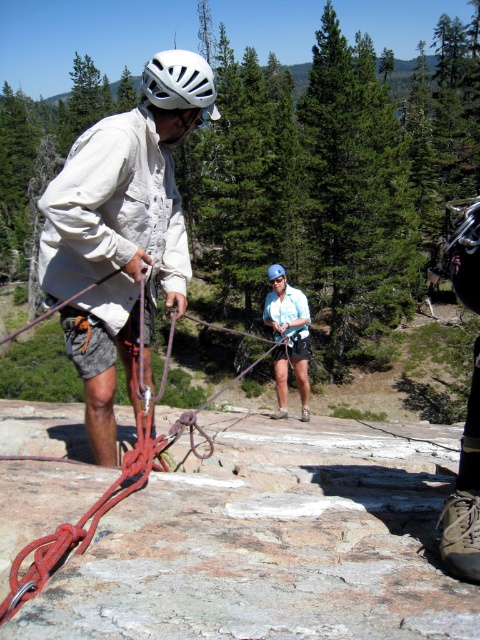
Is blue fabric shirt at center below white matte helmet at upper center?

Yes.

Is blue fabric shirt at center taller than white matte helmet at upper center?

In fact, blue fabric shirt at center may be shorter than white matte helmet at upper center.

Find the location of a particular element. This screenshot has width=480, height=640. blue fabric shirt at center is located at coordinates (288, 337).

Locate an element on the screen. The height and width of the screenshot is (640, 480). blue fabric shirt at center is located at coordinates (288, 337).

Who is higher up, red synthetic rope at center or white matte helmet at upper center?

white matte helmet at upper center is above.

Which is more to the right, red synthetic rope at center or white matte helmet at upper center?

Positioned to the right is red synthetic rope at center.

In the scene shown: Measure the distance between red synthetic rope at center and camera.

red synthetic rope at center and camera are 6.14 feet apart.

Find the location of a particular element. This screenshot has width=480, height=640. red synthetic rope at center is located at coordinates (111, 483).

Based on the photo, who is higher up, white matte helmet at center or white matte helmet at upper center?

white matte helmet at upper center is higher up.

This screenshot has height=640, width=480. What do you see at coordinates (121, 230) in the screenshot?
I see `white matte helmet at center` at bounding box center [121, 230].

Who is more forward, (60, 284) or (168, 70)?

Point (168, 70) is more forward.

Locate an element on the screen. This screenshot has width=480, height=640. white matte helmet at center is located at coordinates (121, 230).